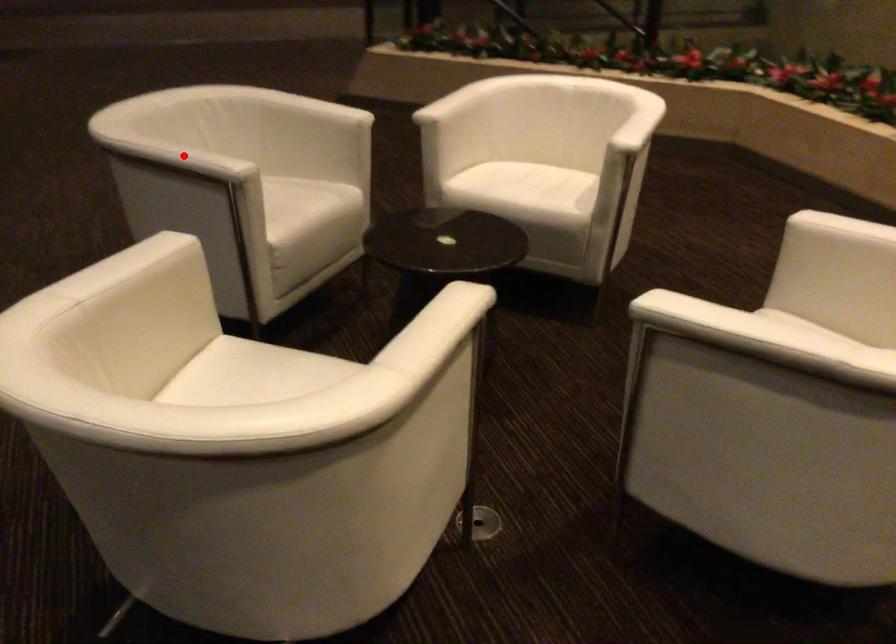
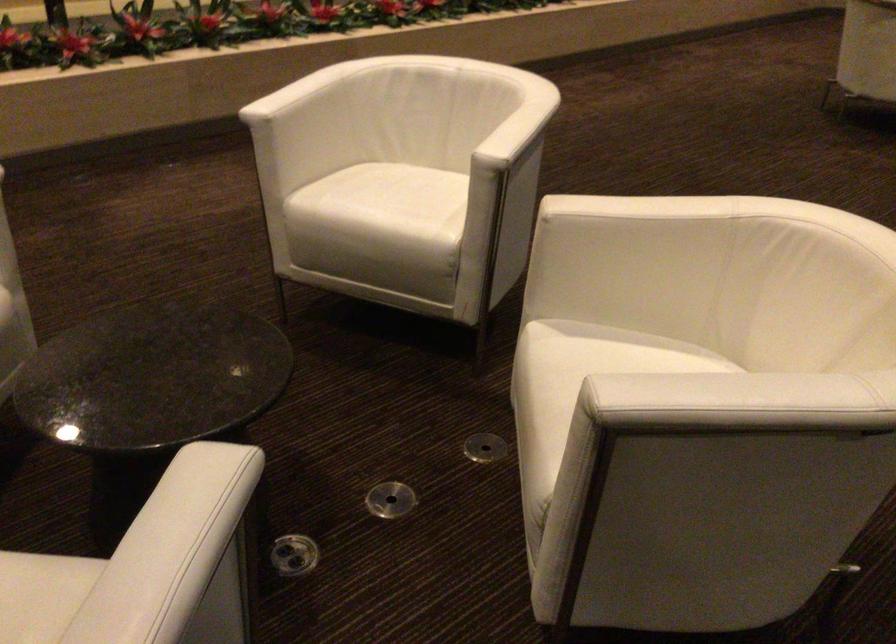
Locate, in the second image, the point that corresponds to the highlighted location in the first image.

(186, 527)